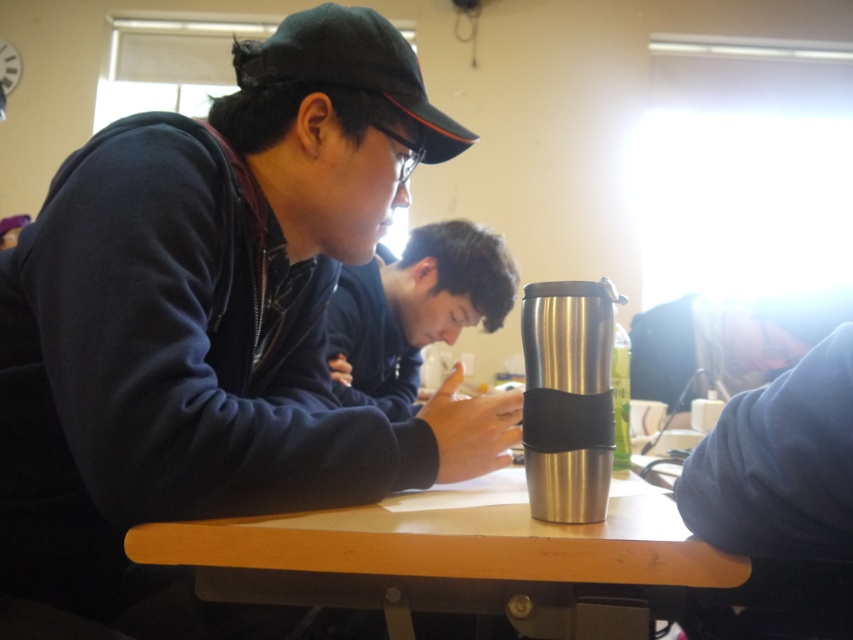
You are a student trying to place your matte black phone at center and black fabric baseball cap at upper left on a narrow desk. Which object should you place first to ensure both fit on the desk without overlapping?

The matte black phone at center is wider than the black fabric baseball cap at upper left. To fit both on the desk without overlapping, place the wider matte black phone at center first, then position the narrower black fabric baseball cap at upper left next to it.